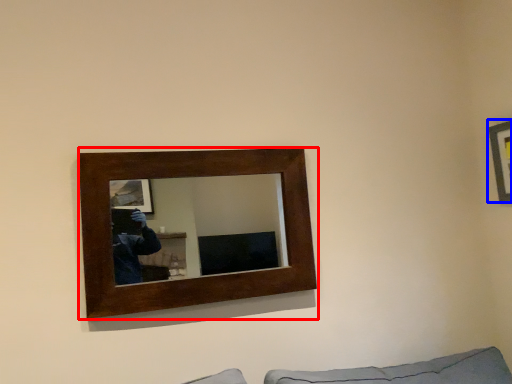
Question: Which object appears farthest to the camera in this image, picture frame (highlighted by a red box) or picture frame (highlighted by a blue box)?

Choices:
 (A) picture frame
 (B) picture frame

Answer: (B)